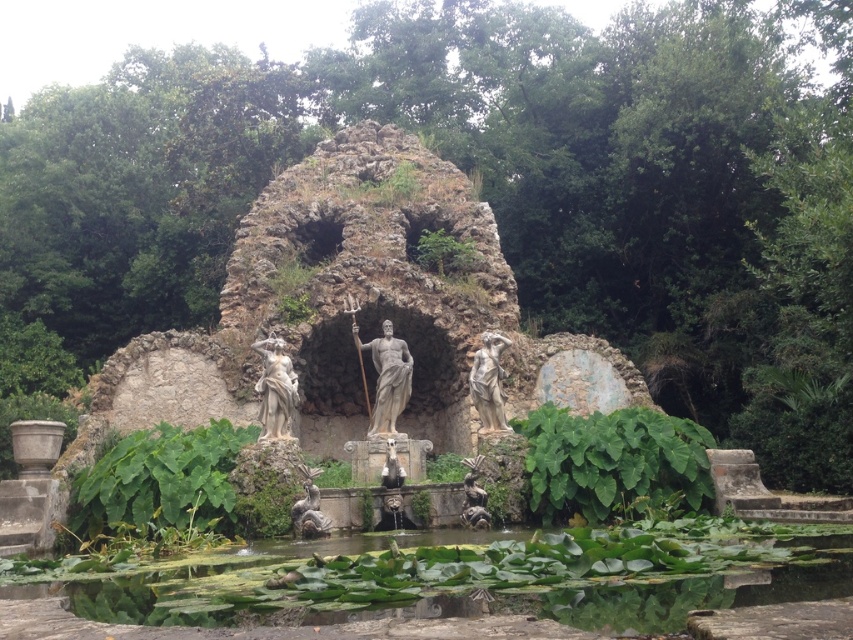
Is matte gray statue at center bigger than polished bronze statue at center?

Yes, matte gray statue at center is bigger than polished bronze statue at center.

Is matte gray statue at center taller than polished bronze statue at center?

Indeed, matte gray statue at center has a greater height compared to polished bronze statue at center.

Describe the element at coordinates (488, 381) in the screenshot. I see `matte gray statue at center` at that location.

Locate an element on the screen. The image size is (853, 640). matte gray statue at center is located at coordinates pyautogui.click(x=488, y=381).

Is white marble statue at left positioned at the back of matte bronze statue at center?

Yes, it is.

Does point (273, 333) come in front of point (321, 536)?

No, it is behind (321, 536).

Is point (291, 413) less distant than point (316, 512)?

No, it is not.

You are a GUI agent. You are given a task and a screenshot of the screen. Output one action in this format:
    pyautogui.click(x=<x>, y=<y>)
    Task: Click on the white marble statue at left
    The image size is (853, 640).
    Given the screenshot: What is the action you would take?
    pyautogui.click(x=276, y=388)

Consider the image. Is green leafy pond at center bigger than white marble statue at center?

Correct, green leafy pond at center is larger in size than white marble statue at center.

Between point (173, 595) and point (392, 422), which one is positioned behind?

Point (392, 422)

This screenshot has height=640, width=853. I want to click on green leafy pond at center, so click(422, 593).

You are a GUI agent. You are given a task and a screenshot of the screen. Output one action in this format:
    pyautogui.click(x=<x>, y=<y>)
    Task: Click on the green leafy pond at center
    This screenshot has height=640, width=853.
    Given the screenshot: What is the action you would take?
    pyautogui.click(x=422, y=593)